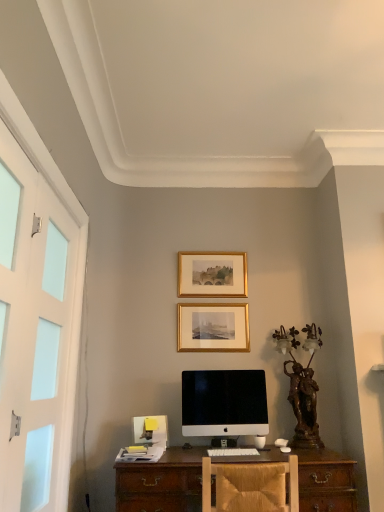
Question: Can you confirm if white matte screen door at left is thinner than gold metallic picture frame at center, which is the second picture frame from top to bottom?

Choices:
 (A) no
 (B) yes

Answer: (A)

Question: Is white matte screen door at left taller than gold metallic picture frame at center, positioned as the 1th picture frame in bottom-to-top order?

Choices:
 (A) no
 (B) yes

Answer: (B)

Question: Is gold metallic picture frame at center, which is the second picture frame from top to bottom, surrounded by white matte screen door at left?

Choices:
 (A) no
 (B) yes

Answer: (A)

Question: From the image's perspective, is white matte screen door at left located beneath gold metallic picture frame at center, which is the second picture frame from top to bottom?

Choices:
 (A) yes
 (B) no

Answer: (B)

Question: Is white matte screen door at left aimed at gold metallic picture frame at center, positioned as the 1th picture frame in bottom-to-top order?

Choices:
 (A) yes
 (B) no

Answer: (B)

Question: From their relative heights in the image, would you say sleek white monitor at center is taller or shorter than gold/gilded picture frame at upper center, positioned as the second picture frame in bottom-to-top order?

Choices:
 (A) short
 (B) tall

Answer: (B)

Question: From the image's perspective, is sleek white monitor at center located above or below gold/gilded picture frame at upper center, positioned as the second picture frame in bottom-to-top order?

Choices:
 (A) below
 (B) above

Answer: (A)

Question: Would you say sleek white monitor at center is inside or outside gold/gilded picture frame at upper center, positioned as the second picture frame in bottom-to-top order?

Choices:
 (A) outside
 (B) inside

Answer: (A)

Question: In terms of width, does sleek white monitor at center look wider or thinner when compared to gold/gilded picture frame at upper center, positioned as the second picture frame in bottom-to-top order?

Choices:
 (A) wide
 (B) thin

Answer: (A)

Question: Looking at their shapes, would you say white matte screen door at left is wider or thinner than bronze statue at right?

Choices:
 (A) thin
 (B) wide

Answer: (A)

Question: From the image's perspective, is white matte screen door at left positioned above or below bronze statue at right?

Choices:
 (A) below
 (B) above

Answer: (B)

Question: Is white matte screen door at left in front of or behind bronze statue at right in the image?

Choices:
 (A) front
 (B) behind

Answer: (A)

Question: Based on their positions, is white matte screen door at left located to the left or right of bronze statue at right?

Choices:
 (A) right
 (B) left

Answer: (B)

Question: Considering their positions, is gold metallic picture frame at center, positioned as the 1th picture frame in bottom-to-top order, located in front of or behind white matte screen door at left?

Choices:
 (A) behind
 (B) front

Answer: (A)

Question: From a real-world perspective, is gold metallic picture frame at center, positioned as the 1th picture frame in bottom-to-top order, physically located above or below white matte screen door at left?

Choices:
 (A) above
 (B) below

Answer: (A)